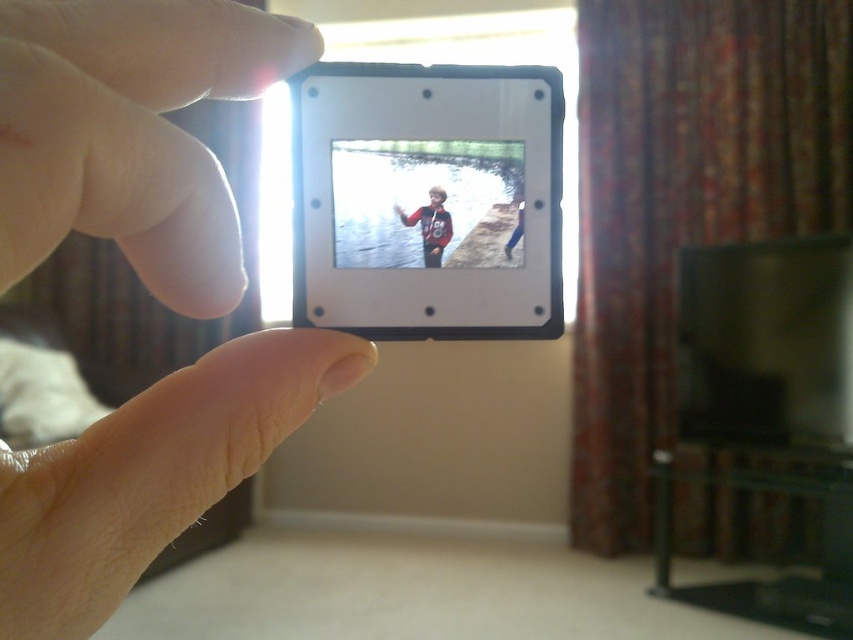
Between matte plastic hand at center and white matte hand at upper left, which one has less height?

white matte hand at upper left

Does matte plastic hand at center lie in front of white matte hand at upper left?

Yes, it is in front of white matte hand at upper left.

The height and width of the screenshot is (640, 853). In order to click on matte plastic hand at center in this screenshot , I will do `click(131, 132)`.

At what (x,y) coordinates should I click in order to perform the action: click on matte plastic hand at center. Please return your answer as a coordinate pair (x, y). This screenshot has height=640, width=853. Looking at the image, I should click on (131, 132).

Which is more to the right, white matte hand at upper left or matte red shirt at center?

matte red shirt at center is more to the right.

Between point (152, 173) and point (426, 211), which one is positioned in front?

Point (152, 173) is more forward.

Who is more forward, (306,42) or (432,236)?

Positioned in front is point (306,42).

Identify the location of white matte hand at upper left. This screenshot has width=853, height=640. (131, 132).

Is matte plastic hand at center positioned before matte red shirt at center?

Yes.

Who is more distant from viewer, (149, 205) or (450, 237)?

The point (450, 237) is behind.

The height and width of the screenshot is (640, 853). What are the coordinates of `matte plastic hand at center` in the screenshot? It's located at pos(131,132).